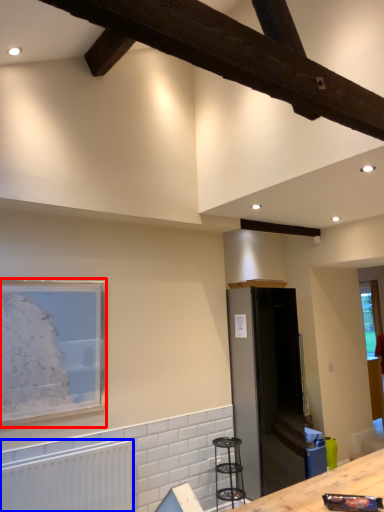
Question: Which object appears farthest to the camera in this image, picture frame (highlighted by a red box) or radiator (highlighted by a blue box)?

Choices:
 (A) picture frame
 (B) radiator

Answer: (A)